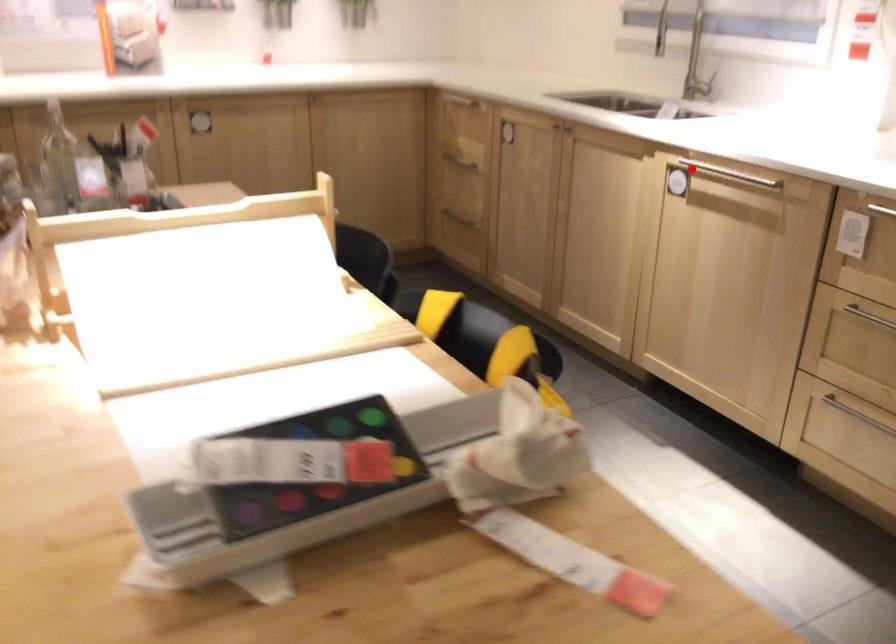
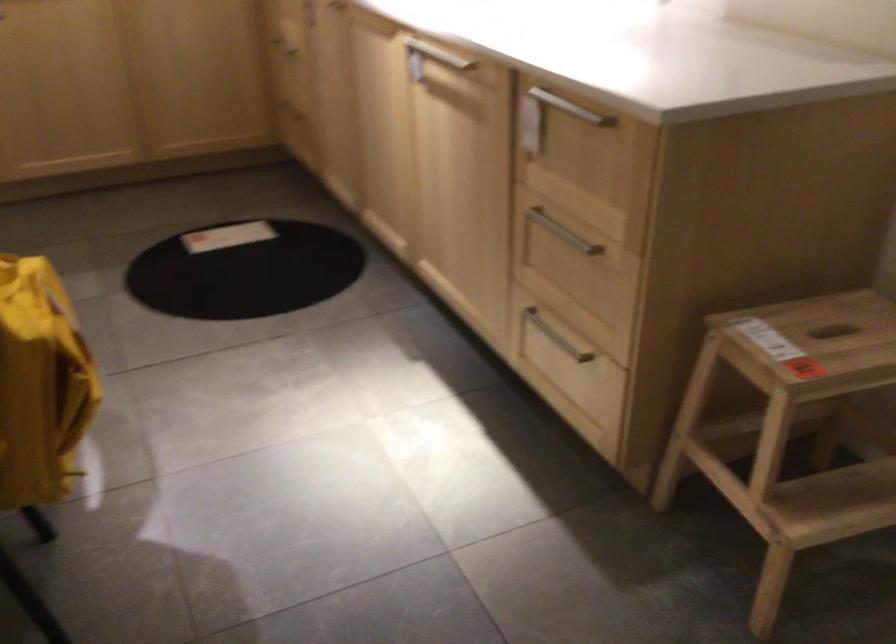
In the second image, find the point that corresponds to the highlighted location in the first image.

(428, 59)